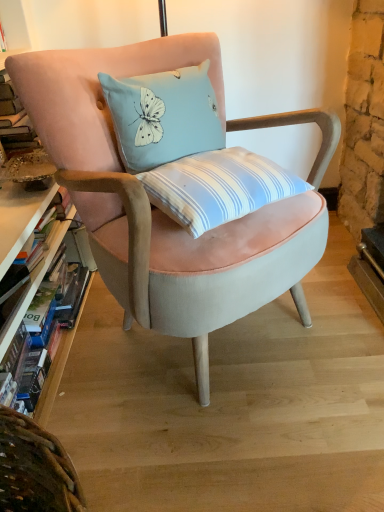
Question: From a real-world perspective, is hardcover book at left positioned above or below velvet pink chair at center?

Choices:
 (A) above
 (B) below

Answer: (B)

Question: From their relative heights in the image, would you say hardcover book at left is taller or shorter than velvet pink chair at center?

Choices:
 (A) short
 (B) tall

Answer: (A)

Question: Looking at their shapes, would you say hardcover book at left is wider or thinner than velvet pink chair at center?

Choices:
 (A) thin
 (B) wide

Answer: (A)

Question: Choose the correct answer: Is velvet pink chair at center inside hardcover book at left or outside it?

Choices:
 (A) outside
 (B) inside

Answer: (A)

Question: Considering the relative positions of velvet pink chair at center and hardcover book at left in the image provided, is velvet pink chair at center to the left or to the right of hardcover book at left?

Choices:
 (A) left
 (B) right

Answer: (B)

Question: Based on their sizes in the image, would you say velvet pink chair at center is bigger or smaller than hardcover book at left?

Choices:
 (A) small
 (B) big

Answer: (B)

Question: From the image's perspective, is velvet pink chair at center positioned above or below hardcover book at left?

Choices:
 (A) below
 (B) above

Answer: (B)